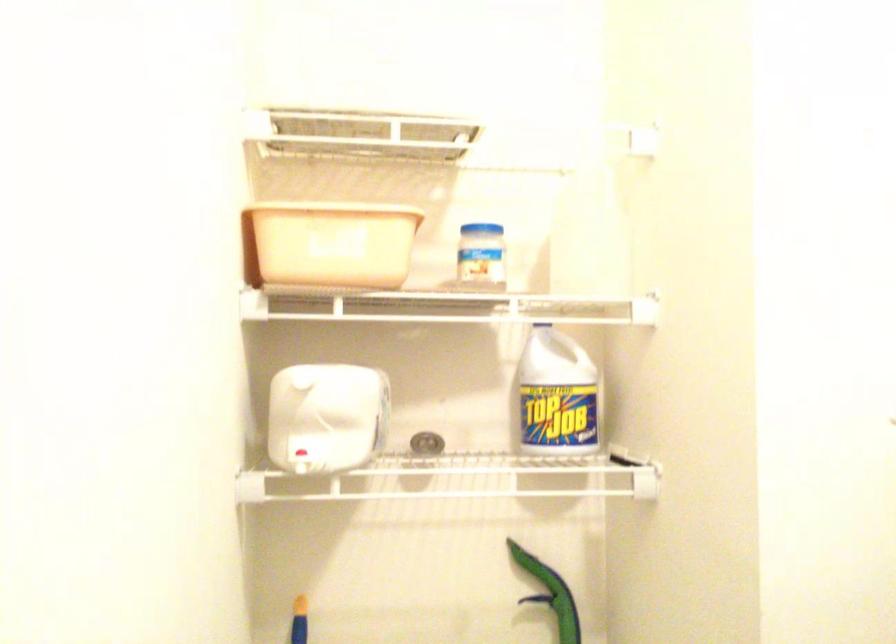
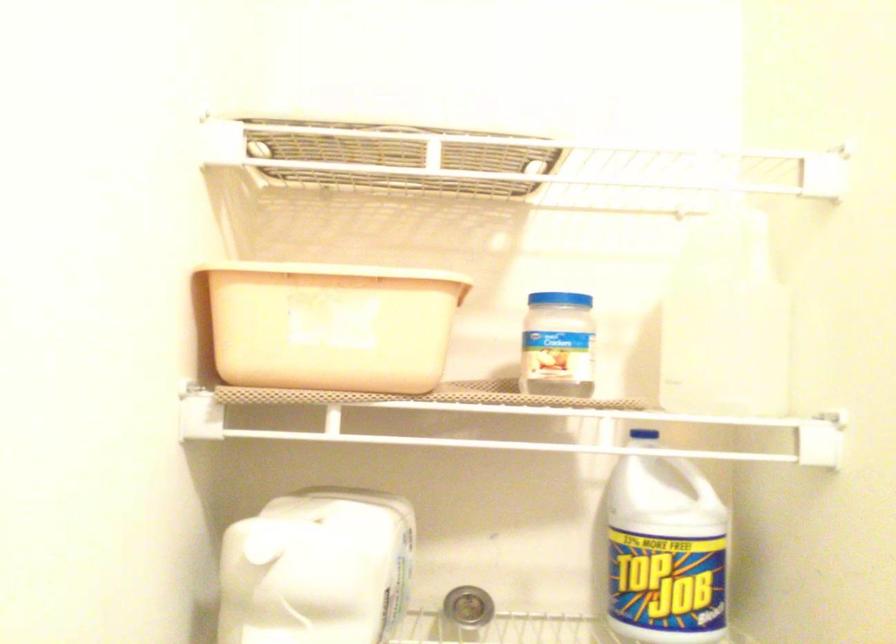
Question: In a continuous first-person perspective shot, in which direction is the camera moving?

Choices:
 (A) Left
 (B) Right
 (C) Forward
 (D) Backward

Answer: (C)